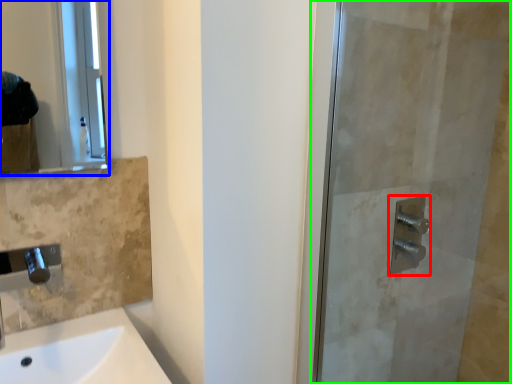
Question: Which object is the farthest from shower (highlighted by a red box)? Choose among these: mirror (highlighted by a blue box) or screen door (highlighted by a green box).

Choices:
 (A) mirror
 (B) screen door

Answer: (A)